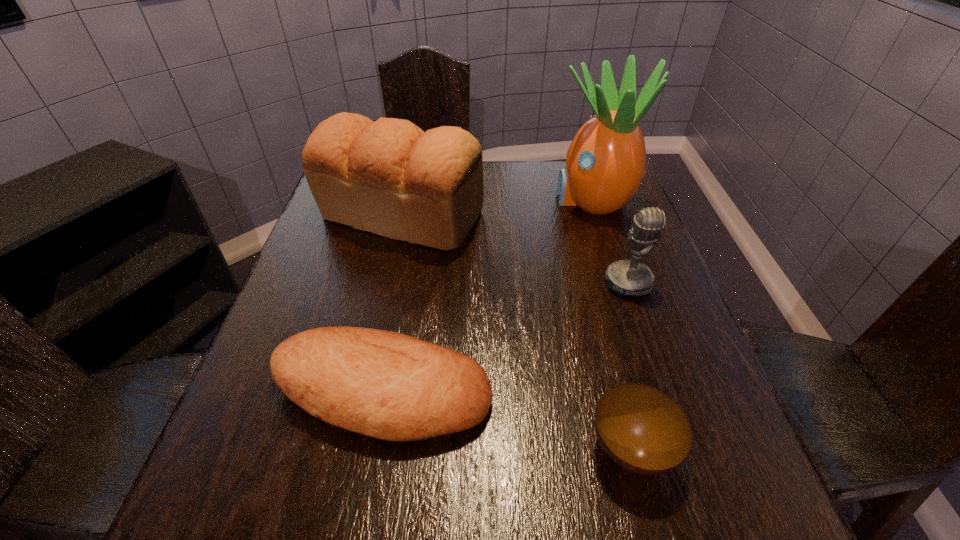
I want to click on free spot that satisfies the following two spatial constraints: 1. at the entrance of the tallest object; 2. on the front side of the second tallest object, so click(597, 215).